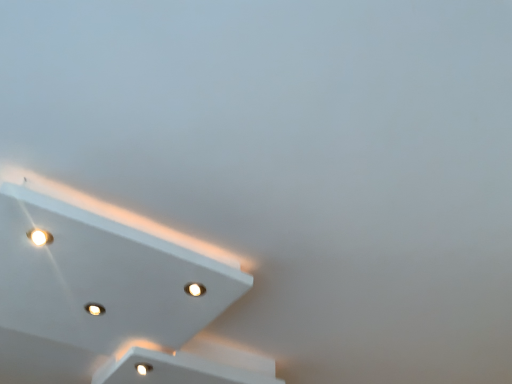
Question: Does matte white light at upper left, acting as the first dot starting from the left, contain white glossy light fixture at upper left?

Choices:
 (A) no
 (B) yes

Answer: (A)

Question: From a real-world perspective, is matte white light at upper left, which is the first dot from top to bottom, positioned under white glossy light fixture at upper left based on gravity?

Choices:
 (A) yes
 (B) no

Answer: (A)

Question: Does matte white light at upper left, the second dot when ordered from back to front, appear on the left side of white glossy light fixture at upper left?

Choices:
 (A) no
 (B) yes

Answer: (B)

Question: Is matte white light at upper left, acting as the first dot starting from the left, aimed at white glossy light fixture at upper left?

Choices:
 (A) yes
 (B) no

Answer: (A)

Question: Is matte white light at upper left, the 2th dot ordered from the bottom, behind white glossy light fixture at upper left?

Choices:
 (A) yes
 (B) no

Answer: (A)

Question: In terms of height, does matte white light at upper left, the second dot when ordered from back to front, look taller or shorter compared to white glossy light fixture at upper left?

Choices:
 (A) short
 (B) tall

Answer: (A)

Question: Is matte white light at upper left, acting as the first dot starting from the left, in front of or behind white glossy light fixture at upper left in the image?

Choices:
 (A) front
 (B) behind

Answer: (B)

Question: Based on their positions, is matte white light at upper left, placed as the 2th dot when sorted from right to left, located to the left or right of white glossy light fixture at upper left?

Choices:
 (A) right
 (B) left

Answer: (B)

Question: Is matte white light at upper left, acting as the first dot starting from the left, bigger or smaller than white glossy light fixture at upper left?

Choices:
 (A) big
 (B) small

Answer: (B)

Question: In the image, is white glossy light fixture at upper left positioned in front of or behind white glossy light at bottom left, the 2th dot when ordered from front to back?

Choices:
 (A) behind
 (B) front

Answer: (B)

Question: Considering the positions of white glossy light fixture at upper left and white glossy light at bottom left, the 1th dot in the right-to-left sequence, in the image, is white glossy light fixture at upper left taller or shorter than white glossy light at bottom left, the 1th dot in the right-to-left sequence,?

Choices:
 (A) short
 (B) tall

Answer: (B)

Question: Visually, is white glossy light fixture at upper left positioned to the left or to the right of white glossy light at bottom left, arranged as the first dot when viewed from the back?

Choices:
 (A) left
 (B) right

Answer: (A)

Question: Is white glossy light fixture at upper left situated inside white glossy light at bottom left, the 2th dot when ordered from front to back, or outside?

Choices:
 (A) outside
 (B) inside

Answer: (A)

Question: Considering the positions of matte white light at upper left, acting as the first dot starting from the left, and white glossy light at bottom left, the 1th dot when ordered from bottom to top, in the image, is matte white light at upper left, acting as the first dot starting from the left, wider or thinner than white glossy light at bottom left, the 1th dot when ordered from bottom to top,?

Choices:
 (A) wide
 (B) thin

Answer: (B)

Question: Which is correct: matte white light at upper left, acting as the first dot starting from the left, is inside white glossy light at bottom left, the 2th dot in the left-to-right sequence, or outside of it?

Choices:
 (A) inside
 (B) outside

Answer: (B)